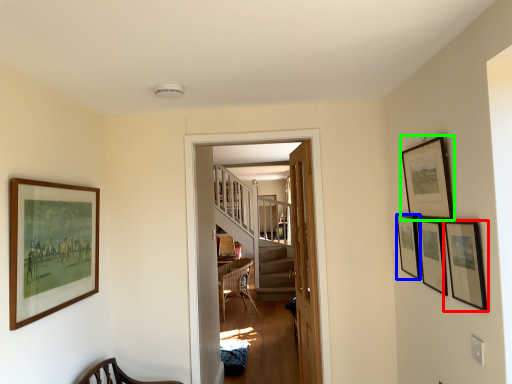
Question: Estimate the real-world distances between objects in this image. Which object is closer to picture frame (highlighted by a red box), picture frame (highlighted by a blue box) or picture frame (highlighted by a green box)?

Choices:
 (A) picture frame
 (B) picture frame

Answer: (B)